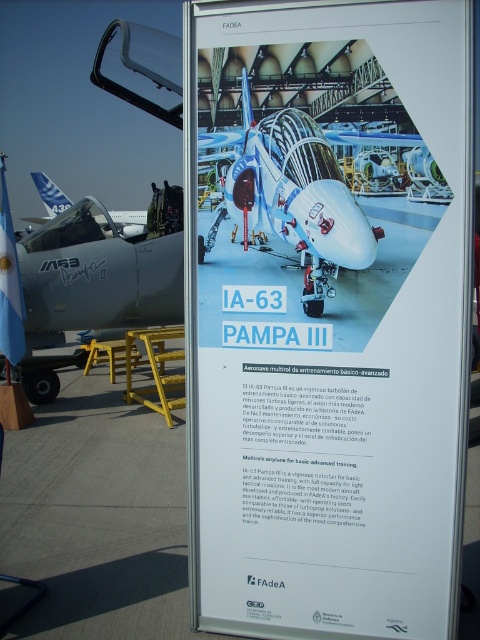
Can you confirm if matte gray aircraft at left is positioned above matte blue airplane at center?

Correct, matte gray aircraft at left is located above matte blue airplane at center.

Is matte gray aircraft at left smaller than matte blue airplane at center?

Yes.

At what (x,y) coordinates should I click in order to perform the action: click on matte gray aircraft at left. Please return your answer as a coordinate pair (x, y). Looking at the image, I should click on (104, 268).

Can you confirm if matte blue airplane at center is thinner than matte white airplane at center?

No, matte blue airplane at center is not thinner than matte white airplane at center.

Can you confirm if matte blue airplane at center is positioned to the left of matte white airplane at center?

No, matte blue airplane at center is not to the left of matte white airplane at center.

Find the location of a particular element. matte blue airplane at center is located at coordinates (288, 195).

Can you confirm if white glossy ia-63 pampa iii at center is positioned below matte blue airplane at center?

Correct, white glossy ia-63 pampa iii at center is located below matte blue airplane at center.

Is white glossy ia-63 pampa iii at center thinner than matte blue airplane at center?

Incorrect, white glossy ia-63 pampa iii at center's width is not less than matte blue airplane at center's.

Find the location of a particular element. white glossy ia-63 pampa iii at center is located at coordinates (327, 314).

Where is `white glossy ia-63 pampa iii at center`? Image resolution: width=480 pixels, height=640 pixels. white glossy ia-63 pampa iii at center is located at coordinates (327, 314).